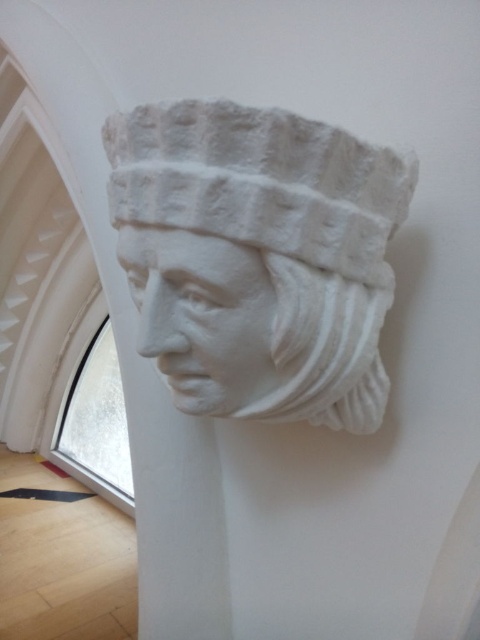
Which is in front, point (112, 136) or point (140, 256)?

Point (140, 256) is in front.

Is white stone bust at upper center smaller than white stone sculpture at center?

No.

Which is behind, point (292, 212) or point (164, 298)?

The point (164, 298) is behind.

Locate an element on the screen. The height and width of the screenshot is (640, 480). white stone bust at upper center is located at coordinates (257, 257).